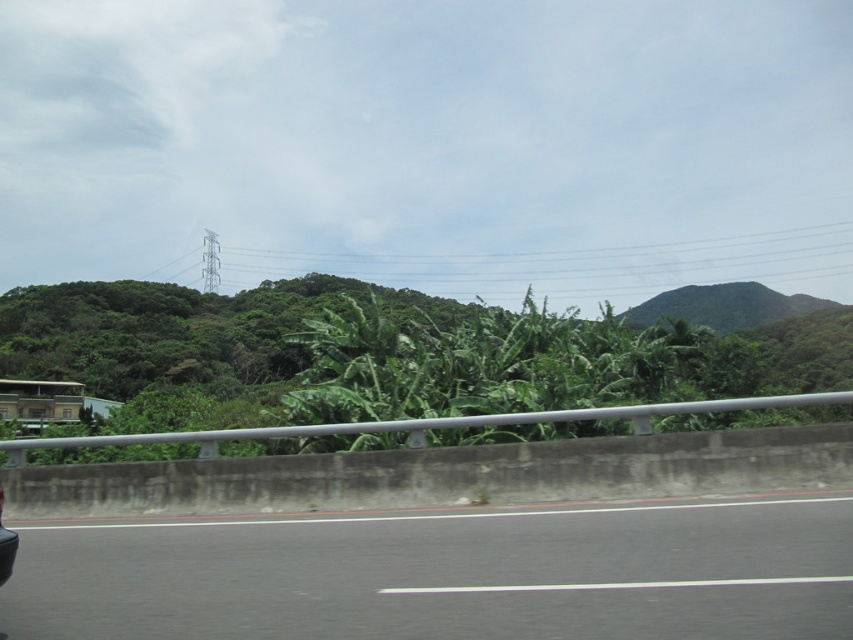
You are a passenger in a car driving along the black asphalt highway at lower left. You notice the green leafy vegetation at center through the window. Which object is closer to you as you look out the window?

The black asphalt highway at lower left is closer to you because it is in front of the green leafy vegetation at center.

You are a passenger in the shiny black car at lower left. You notice the black asphalt highway at lower left. From your perspective inside the car, which side of the car is the highway located?

The black asphalt highway at lower left is positioned on the right side of the shiny black car at lower left, so from the passenger seat perspective, the highway is on your right side.

You are a photographer trying to capture the shiny black car at lower left without any obstructions. Based on the scene, will the metallic gray power line at upper center block your view of the car?

The metallic gray power line at upper center is further to the viewer than the shiny black car at lower left, so it will block your view of the car.